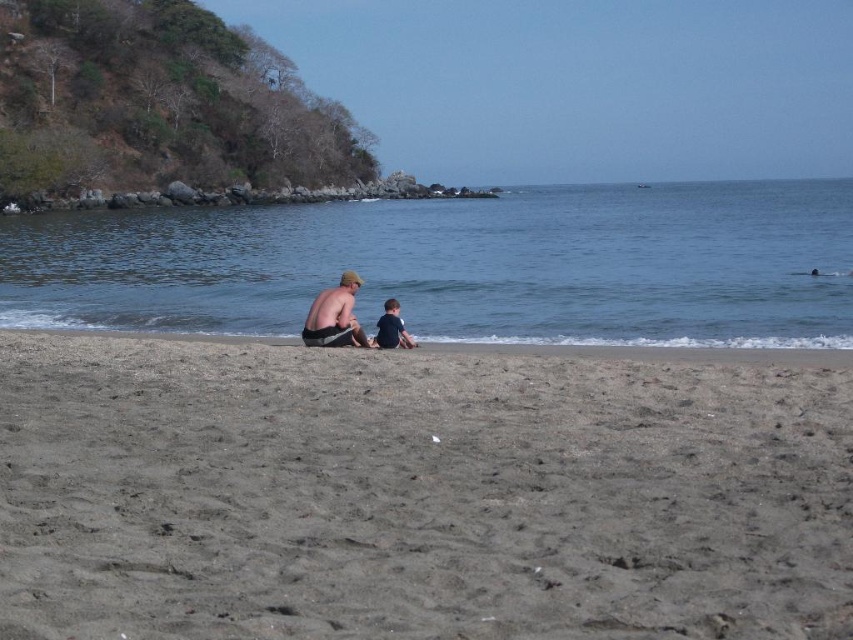
Is the position of matte black shorts at center more distant than that of dark blue shirt at center?

No, it is not.

Is the position of matte black shorts at center less distant than that of dark blue shirt at center?

That is True.

Where is `matte black shorts at center`? The height and width of the screenshot is (640, 853). matte black shorts at center is located at coordinates (334, 316).

Identify the location of matte black shorts at center. (334, 316).

In the scene shown: Does blue water at center have a lesser height compared to dark blue shirt at center?

No, blue water at center is not shorter than dark blue shirt at center.

Who is more forward, (210, 214) or (384, 333)?

Point (384, 333)

Find the location of a particular element. This screenshot has width=853, height=640. blue water at center is located at coordinates (461, 266).

Describe the element at coordinates (461, 266) in the screenshot. This screenshot has width=853, height=640. I see `blue water at center` at that location.

Is blue water at center positioned at the back of matte black shorts at center?

That is True.

Between point (524, 224) and point (335, 298), which one is positioned in front?

Point (335, 298)

You are a GUI agent. You are given a task and a screenshot of the screen. Output one action in this format:
    pyautogui.click(x=<x>, y=<y>)
    Task: Click on the blue water at center
    This screenshot has height=640, width=853.
    Given the screenshot: What is the action you would take?
    pyautogui.click(x=461, y=266)